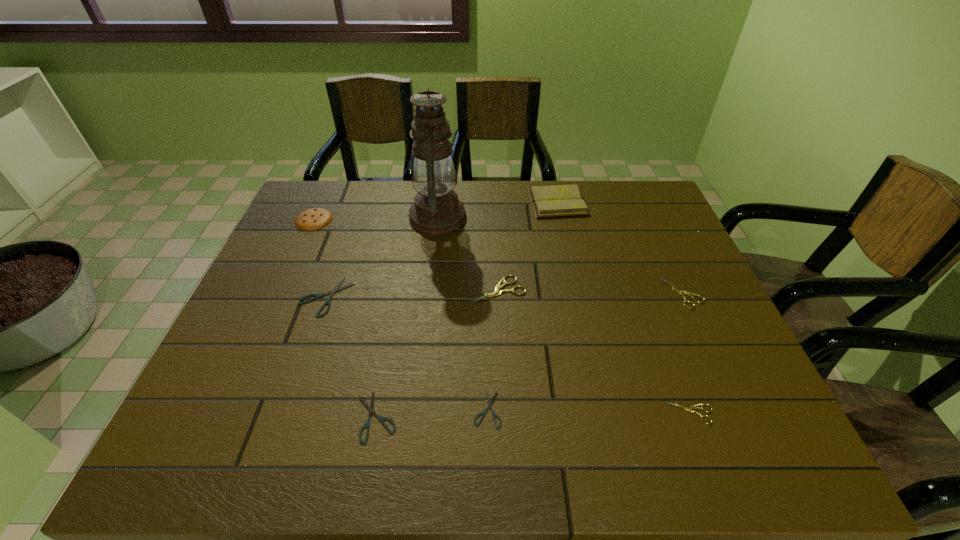
What are the coordinates of `unoccupied area between the farthest black shears and the diary` in the screenshot? It's located at (443, 249).

Where is `blank region between the biggest black shears and the seventh shortest object`? blank region between the biggest black shears and the seventh shortest object is located at coordinates (321, 258).

Find the location of a particular element. The image size is (960, 540). unoccupied position between the leftmost black shears and the second black shears from left to right is located at coordinates (351, 356).

In order to click on unoccupied area between the smallest beige shears and the leftmost black shears in this screenshot , I will do `click(509, 354)`.

Find the location of `free spot between the second biggest black shears and the smallest beige shears`. free spot between the second biggest black shears and the smallest beige shears is located at coordinates (534, 414).

I want to click on blank region between the fifth shortest shears and the leftmost beige shears, so click(590, 292).

Where is `vacant region between the rightmost shears and the tallest object`? This screenshot has width=960, height=540. vacant region between the rightmost shears and the tallest object is located at coordinates (561, 255).

The width and height of the screenshot is (960, 540). I want to click on object that can be found as the second closest to the shortest object, so click(497, 291).

You are a GUI agent. You are given a task and a screenshot of the screen. Output one action in this format:
    pyautogui.click(x=<x>, y=<y>)
    Task: Click on the fifth closest object to the second biggest black shears
    Image resolution: width=960 pixels, height=540 pixels.
    Given the screenshot: What is the action you would take?
    pos(690,409)

This screenshot has width=960, height=540. What are the coordinates of `shears that is the third closest to the second tallest shears` in the screenshot? It's located at (483, 413).